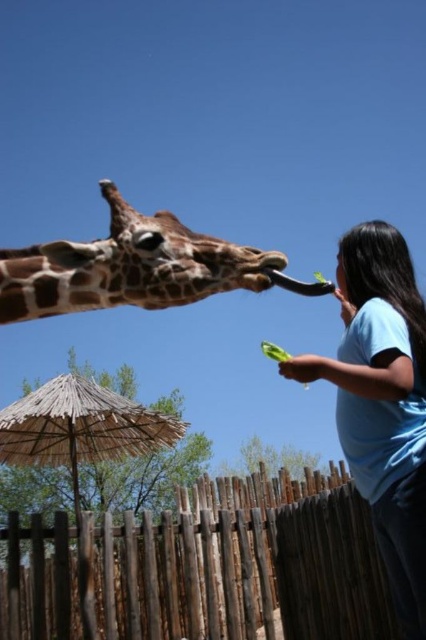
You are a zookeeper observing the scene. You notice the blue cotton shirt at right and the spotted brown giraffe at center. Which object is closer to you, the observer?

The blue cotton shirt at right is closer to you because it is in front of the spotted brown giraffe at center.

You are a zookeeper who needs to ensure the safety of both visitors and animals. The brown wooden fence at lower center and the spotted brown giraffe at center are in the enclosure. Considering their heights, which one is shorter?

The brown wooden fence at lower center is shorter than the spotted brown giraffe at center.

You are standing at the zoo and want to take a photo of the giraffe without the brown wooden fence at lower center blocking the view. Where should you position yourself relative to the fence?

To avoid the brown wooden fence at lower center blocking the view, you should position yourself either to the left or right of the fence so that the giraffe is centered in your frame while the fence is out of the shot.